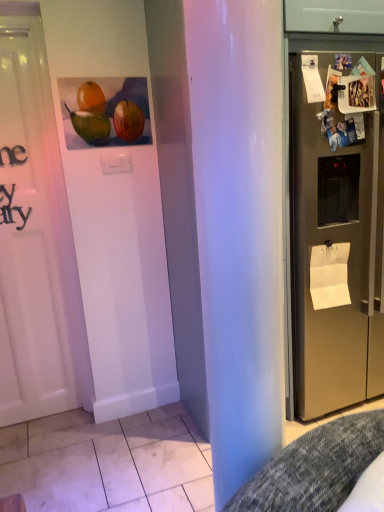
Question: Does satin silver refrigerator at right have a greater width compared to white paper at right, which is counted as the 2th paper, starting from the front?

Choices:
 (A) no
 (B) yes

Answer: (B)

Question: Is satin silver refrigerator at right smaller than white paper at right, the first paper from the bottom?

Choices:
 (A) no
 (B) yes

Answer: (A)

Question: Is satin silver refrigerator at right positioned before white paper at right, the 2th paper viewed from the left?

Choices:
 (A) yes
 (B) no

Answer: (A)

Question: From a real-world perspective, is satin silver refrigerator at right below white paper at right, the 2th paper viewed from the left?

Choices:
 (A) no
 (B) yes

Answer: (A)

Question: From the image's perspective, is satin silver refrigerator at right beneath white paper at right, the first paper from the bottom?

Choices:
 (A) no
 (B) yes

Answer: (A)

Question: From a real-world perspective, is matte acrylic painting of fruits at upper left above or below white paper at upper right, which is counted as the 1th paper, starting from the left?

Choices:
 (A) above
 (B) below

Answer: (B)

Question: In terms of width, does matte acrylic painting of fruits at upper left look wider or thinner when compared to white paper at upper right, the 1th paper when ordered from top to bottom?

Choices:
 (A) wide
 (B) thin

Answer: (B)

Question: Is matte acrylic painting of fruits at upper left taller or shorter than white paper at upper right, positioned as the first paper in front-to-back order?

Choices:
 (A) tall
 (B) short

Answer: (A)

Question: In terms of size, does matte acrylic painting of fruits at upper left appear bigger or smaller than white paper at upper right, which appears as the 2th paper when viewed from the right?

Choices:
 (A) big
 (B) small

Answer: (A)

Question: Is point (314, 71) closer or farther from the camera than point (119, 89)?

Choices:
 (A) closer
 (B) farther

Answer: (A)

Question: In the image, is white paper at upper right, positioned as the first paper in front-to-back order, on the left side or the right side of matte acrylic painting of fruits at upper left?

Choices:
 (A) left
 (B) right

Answer: (B)

Question: In terms of height, does white paper at upper right, marked as the 2th paper in a back-to-front arrangement, look taller or shorter compared to matte acrylic painting of fruits at upper left?

Choices:
 (A) short
 (B) tall

Answer: (A)

Question: From the image's perspective, is white paper at upper right, positioned as the 2th paper in bottom-to-top order, located above or below matte acrylic painting of fruits at upper left?

Choices:
 (A) above
 (B) below

Answer: (A)

Question: Is white paper at upper right, positioned as the 2th paper in bottom-to-top order, taller or shorter than satin silver refrigerator at right?

Choices:
 (A) short
 (B) tall

Answer: (A)

Question: Is point (306, 74) positioned closer to the camera than point (344, 181)?

Choices:
 (A) farther
 (B) closer

Answer: (B)